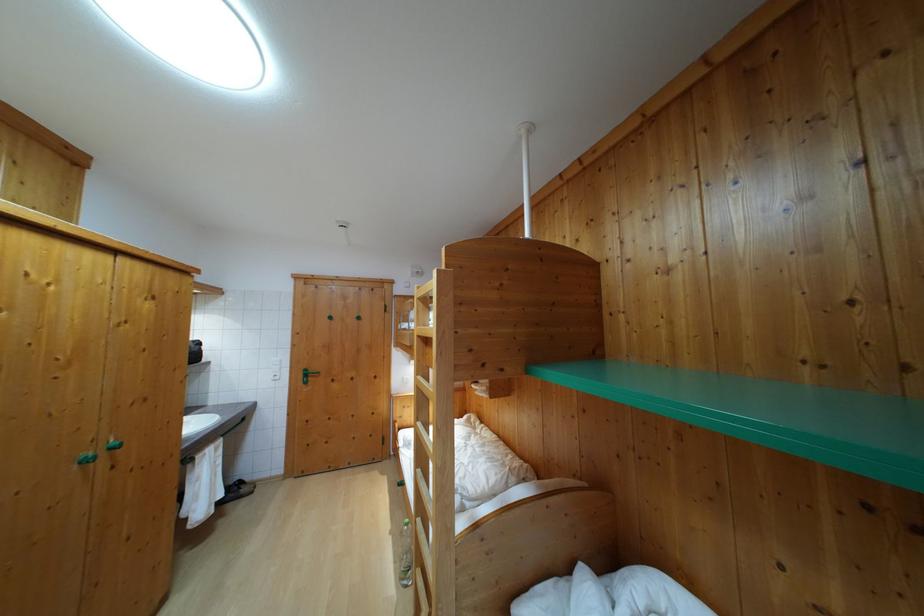
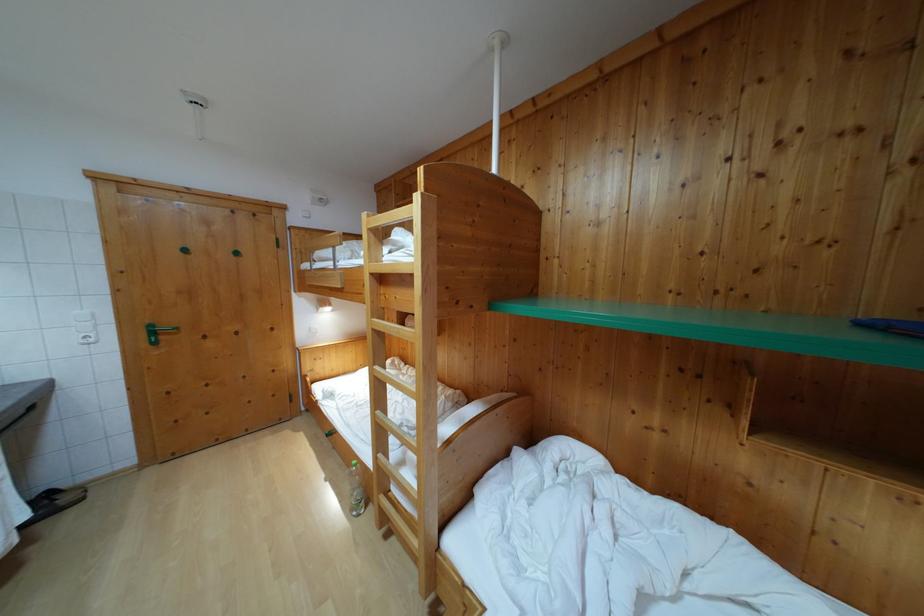
In the second image, find the point that corresponds to (421,294) in the first image.

(371, 223)